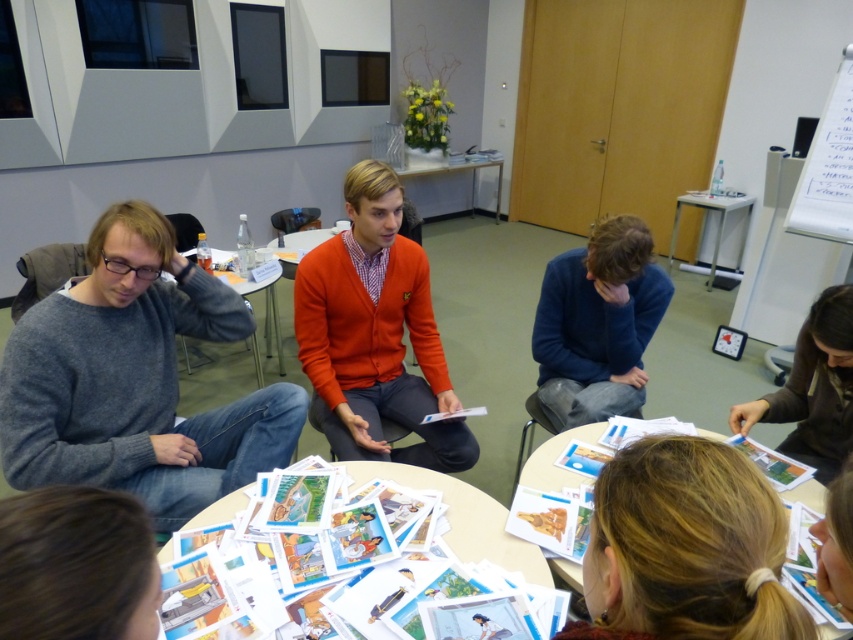
Image resolution: width=853 pixels, height=640 pixels. What do you see at coordinates (76, 564) in the screenshot? I see `brown hair at lower left` at bounding box center [76, 564].

Is brown hair at lower left closer to camera compared to matte gray table at center?

Yes, it is in front of matte gray table at center.

Which is in front, point (134, 513) or point (245, 291)?

Point (134, 513) is more forward.

Where is `brown hair at lower left`? The width and height of the screenshot is (853, 640). brown hair at lower left is located at coordinates (76, 564).

Is point (123, 627) more distant than point (643, 330)?

No, (123, 627) is closer to viewer.

Is brown hair at lower left positioned before blue sweater at center?

Yes, brown hair at lower left is closer to the viewer.

The height and width of the screenshot is (640, 853). What do you see at coordinates (76, 564) in the screenshot? I see `brown hair at lower left` at bounding box center [76, 564].

Find the location of a particular element. The width and height of the screenshot is (853, 640). brown hair at lower left is located at coordinates (x=76, y=564).

Can you confirm if gray sweater at left is smaller than metallic silver table at upper right?

Correct, gray sweater at left occupies less space than metallic silver table at upper right.

Where is `gray sweater at left`? gray sweater at left is located at coordinates coord(134,380).